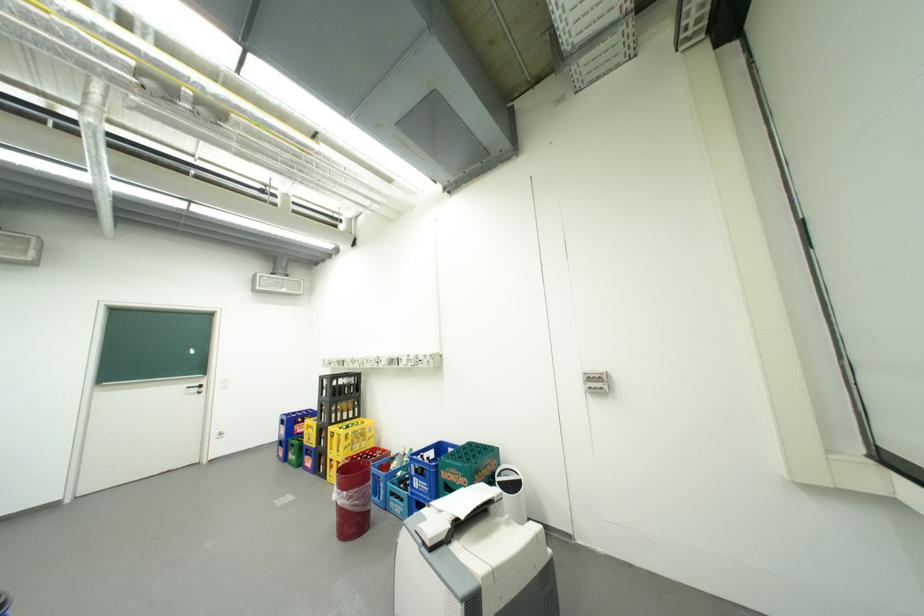
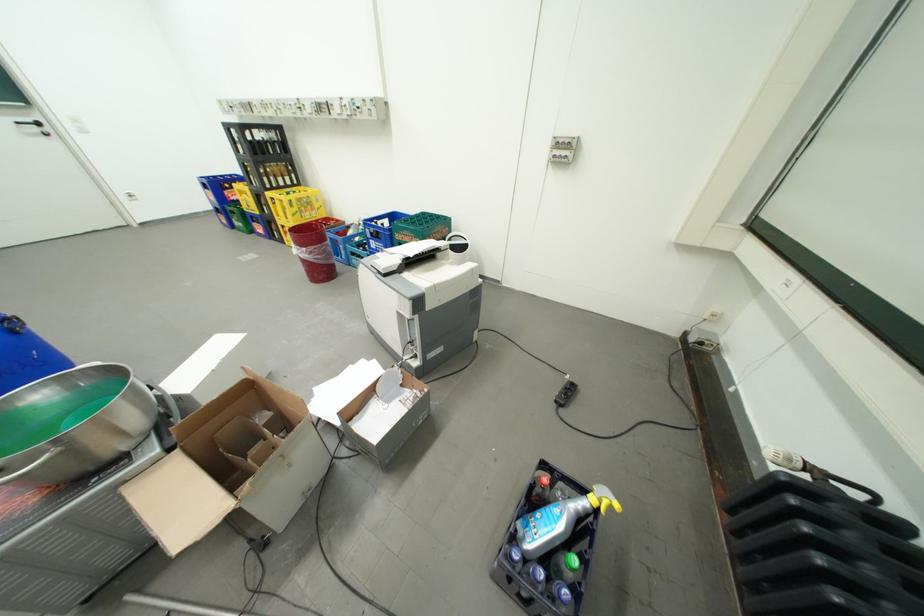
In the second image, find the point that corresponds to [225,437] in the first image.

(134, 199)